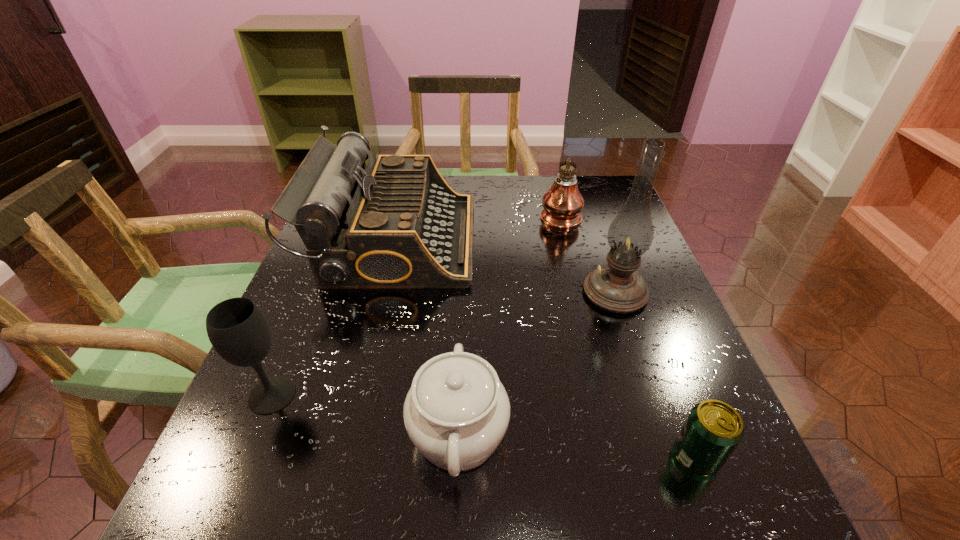
This screenshot has width=960, height=540. What are the coordinates of `beer can located in the right edge section of the desktop` in the screenshot? It's located at (712, 431).

What are the coordinates of `object that is at the far left corner` in the screenshot? It's located at (396, 224).

Identify the location of object that is positioned at the far right corner. The image size is (960, 540). (563, 202).

At what (x,y) coordinates should I click in order to perform the action: click on object positioned at the near right corner. Please return your answer as a coordinate pair (x, y). Looking at the image, I should click on (712, 431).

Where is `free spot at the far edge of the desktop`? This screenshot has height=540, width=960. free spot at the far edge of the desktop is located at coordinates (509, 184).

Locate an element on the screen. The width and height of the screenshot is (960, 540). vacant point at the near edge is located at coordinates (548, 490).

The width and height of the screenshot is (960, 540). I want to click on blank space at the left edge, so 318,411.

What are the coordinates of `free space at the right edge of the desktop` in the screenshot? It's located at (653, 349).

Find the location of a particular element. vacant region at the far right corner of the desktop is located at coordinates point(590,212).

This screenshot has height=540, width=960. Identify the location of free point between the shortest object and the tallest object. (656, 374).